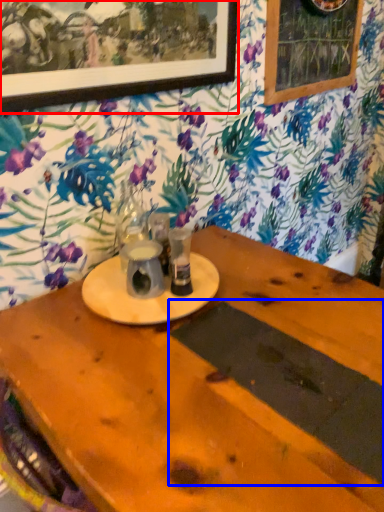
Question: Which point is further to the camera, picture frame (highlighted by a red box) or plank (highlighted by a blue box)?

Choices:
 (A) picture frame
 (B) plank

Answer: (A)